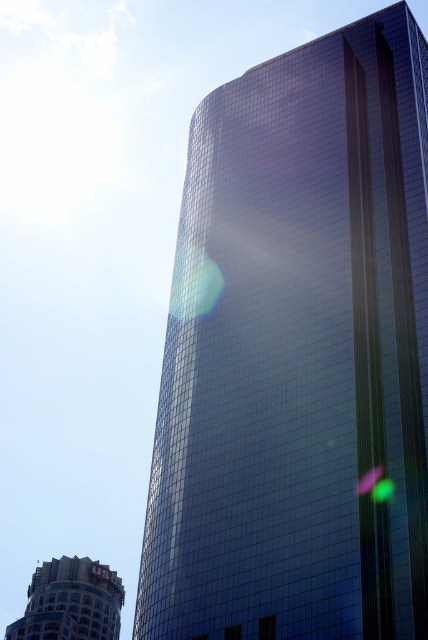
You are standing at the base of the skyscraper and want to take a photo of the point at coordinates (x=166, y=465). Given that the point is 91.06 meters away from the camera, will you need to zoom in or out to capture it clearly?

The point at coordinates (x=166, y=465) is 91.06 meters from the camera. To capture it clearly, you would need to zoom in because the distance is relatively far.

In the scene shown: You are standing in front of the skyscraper and want to take a photo. You notice two points marked on the glass panels of the skyscraper. The first point is at coordinate point (255, 589) and the second is at point (113, 602). Which point appears closer to you in the photo?

Point (255, 589) is closer to the camera than point (113, 602), so it will appear closer in the photo.

You are standing in the city square and see the glossy glass tower at center and the matte silver building at lower left. Which building is positioned to the right side from your viewpoint?

The glossy glass tower at center is positioned to the right of the matte silver building at lower left.